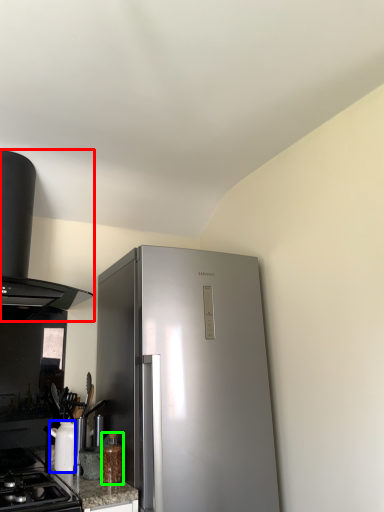
Question: Estimate the real-world distances between objects in this image. Which object is farther from kitchen appliance (highlighted by a red box), appliance (highlighted by a blue box) or bottle (highlighted by a green box)?

Choices:
 (A) appliance
 (B) bottle

Answer: (B)